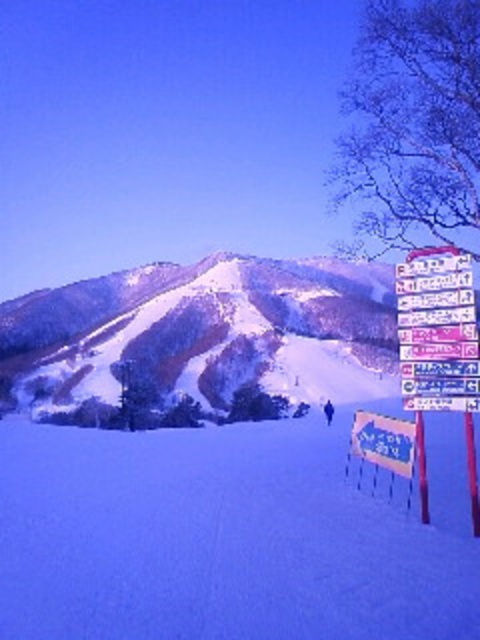
Is white snow ski slope at lower left taller than white plastic sign at right?

Correct, white snow ski slope at lower left is much taller as white plastic sign at right.

Based on the photo, who is lower down, white snow ski slope at lower left or white plastic sign at right?

white snow ski slope at lower left is below.

Who is more forward, (284,632) or (419,380)?

Point (284,632) is in front.

Find the location of a particular element. This screenshot has height=640, width=480. white snow ski slope at lower left is located at coordinates (227, 536).

Is white plastic sign at right to the right of blue plastic sign at lower right from the viewer's perspective?

Correct, you'll find white plastic sign at right to the right of blue plastic sign at lower right.

Between white plastic sign at right and blue plastic sign at lower right, which one appears on the left side from the viewer's perspective?

blue plastic sign at lower right

In the scene shown: Measure the distance between point (448,346) and camera.

52.51 meters

At what (x,y) coordinates should I click in order to perform the action: click on white plastic sign at right. Please return your answer as a coordinate pair (x, y). The height and width of the screenshot is (640, 480). Looking at the image, I should click on (437, 332).

Who is taller, white snow-covered mountain at upper center or blue plastic sign at lower right?

white snow-covered mountain at upper center

Which is in front, point (196, 285) or point (405, 474)?

Point (405, 474) is in front.

Measure the distance between point [337,353] and camera.

Point [337,353] is 1108.58 feet away from camera.

I want to click on white snow-covered mountain at upper center, so click(x=208, y=332).